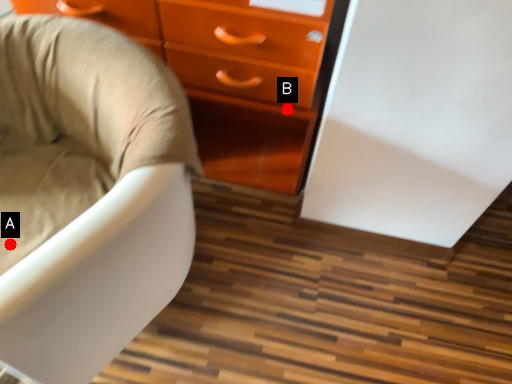
Question: Two points are circled on the image, labeled by A and B beside each circle. Which of the following is the farthest from the observer?

Choices:
 (A) A is further
 (B) B is further

Answer: (B)